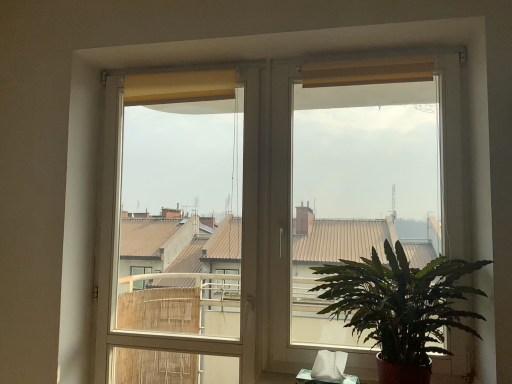
Locate an element on the screen. free space above white plastic window frame at center (from a real-world perspective) is located at coordinates (180, 65).